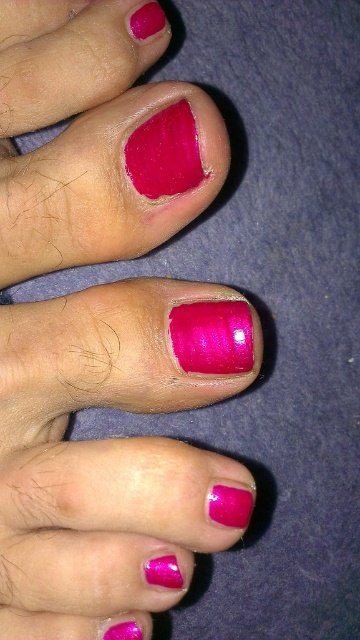
You are a photographer trying to capture a closeup shot of the glossy pink nail at center and the glossy pink nail polish at center. Since both are glossy pink and similar in color, how can you distinguish which one is closer to the camera?

The glossy pink nail at center is in front of the glossy pink nail polish at center, so the nail will appear closer to the camera than the nail polish.

You are a nail technician preparing to apply a new coat of polish to the glossy pink nail at center and the glossy pink nail polish at center. Which object is taller?

The glossy pink nail at center is taller than the glossy pink nail polish at center.